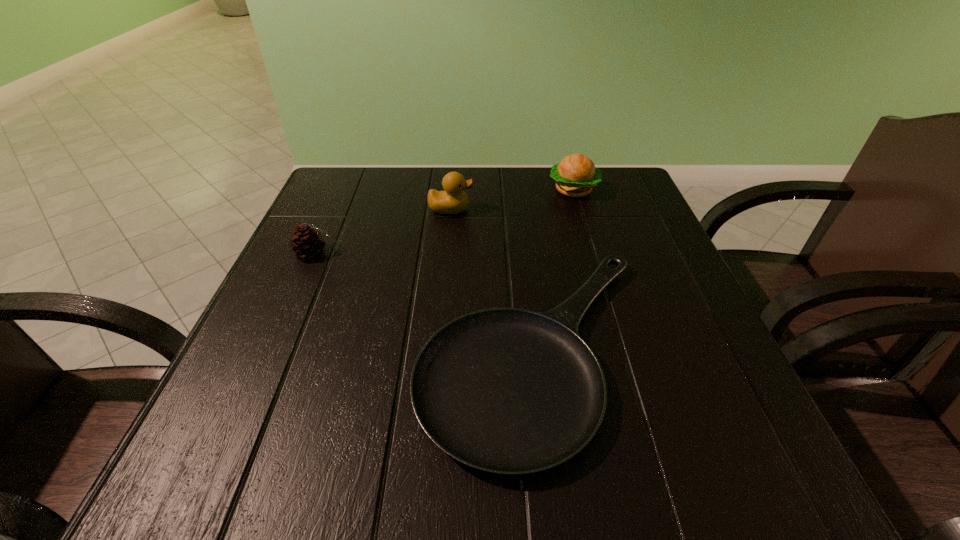
In order to click on vacant region between the shortest object and the duckling in this screenshot , I will do `click(493, 279)`.

Locate an element on the screen. The width and height of the screenshot is (960, 540). free spot between the duckling and the hamburger is located at coordinates (512, 199).

What are the coordinates of `vacant space that's between the leftmost object and the duckling` in the screenshot? It's located at (382, 231).

Where is `free point between the duckling and the pinecone`? This screenshot has width=960, height=540. free point between the duckling and the pinecone is located at coordinates pyautogui.click(x=382, y=231).

Identify the location of vacant space that's between the nearest object and the third tallest object. (425, 301).

I want to click on object that stands as the closest to the third tallest object, so click(510, 391).

Identify which object is located as the second nearest to the leftmost object. Please provide its 2D coordinates. Your answer should be formatted as a tuple, i.e. [(x, y)], where the tuple contains the x and y coordinates of a point satisfying the conditions above.

[(453, 200)]

What are the coordinates of `free spot that satisfies the following two spatial constraints: 1. on the face of the duckling; 2. on the left side of the shortest object` in the screenshot? It's located at (438, 349).

I want to click on free region that satisfies the following two spatial constraints: 1. on the face of the duckling; 2. on the left side of the shortest object, so 438,349.

This screenshot has height=540, width=960. Identify the location of vacant space that satisfies the following two spatial constraints: 1. on the face of the frying pan; 2. on the left side of the duckling. (438, 349).